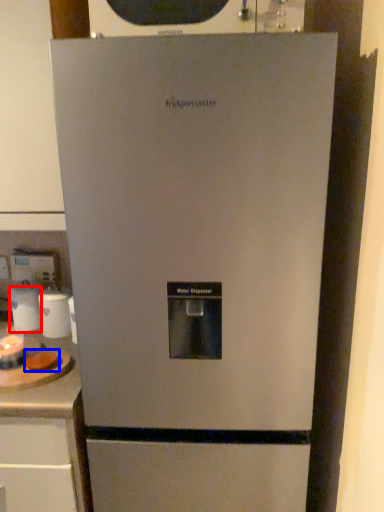
Question: Which point is further to the camera, appliance (highlighted by a red box) or food (highlighted by a blue box)?

Choices:
 (A) appliance
 (B) food

Answer: (A)